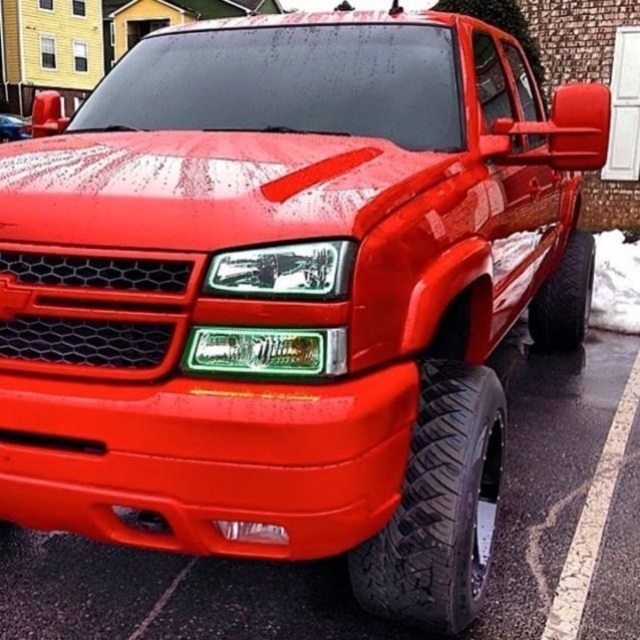
Does black rubber tire at lower right have a lesser height compared to glossy red truck at center?

In fact, black rubber tire at lower right may be taller than glossy red truck at center.

In the scene shown: Between black rubber tire at lower right and glossy red truck at center, which one appears on the left side from the viewer's perspective?

Positioned to the left is glossy red truck at center.

Find the location of a particular element. black rubber tire at lower right is located at coordinates (440, 506).

Locate an element on the screen. This screenshot has width=640, height=640. black rubber tire at lower right is located at coordinates (440, 506).

Is black rubber tire at right thinner than transparent plastic license plate at lower center?

Incorrect, black rubber tire at right's width is not less than transparent plastic license plate at lower center's.

Locate an element on the screen. black rubber tire at right is located at coordinates (564, 298).

Does transparent plastic license plate at lower center come behind glossy red truck at center?

No, transparent plastic license plate at lower center is in front of glossy red truck at center.

Is point (272, 524) positioned behind point (22, 131)?

No, it is not.

This screenshot has width=640, height=640. What are the coordinates of `transparent plastic license plate at lower center` in the screenshot? It's located at (252, 531).